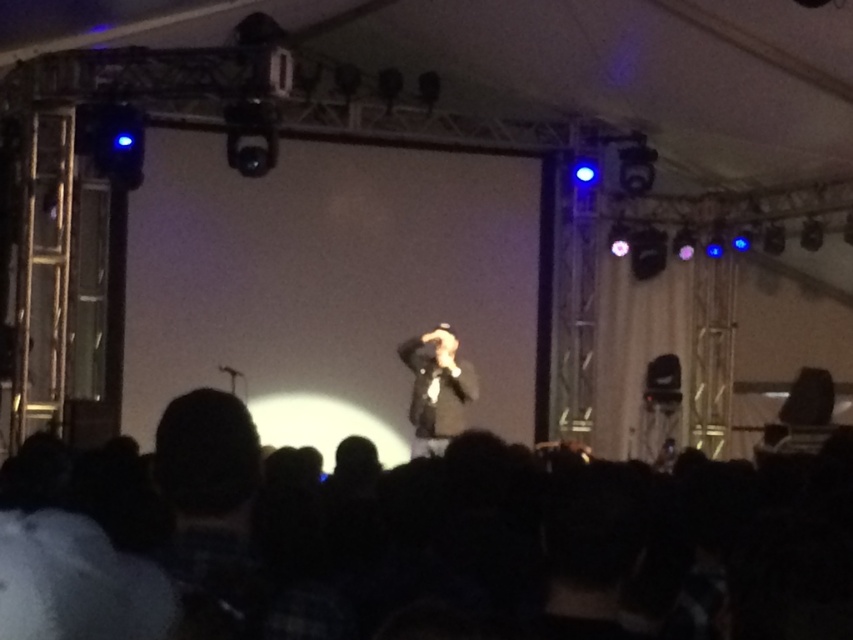
You are an audience member sitting in the front row. You notice a black fabric at lower center and a dark suit at center. Which object is closer to you?

The black fabric at lower center is closer to the viewer than the dark suit at center.

You are a stagehand holding a ladder that is 1.2 meters long. You need to reach the black fabric at lower center to adjust it. Can you safely reach it using the ladder without extending it further?

The distance between the black fabric at lower center and the camera is 1.18 meters, which is slightly less than the ladder length of 1.2 meters. Therefore, the ladder can safely reach the black fabric at lower center when positioned properly.

You are an event organizer checking the stage setup. You notice the black fabric at lower center and the dark suit at center. Which object is located to the left of the other?

The black fabric at lower center is positioned on the left side of dark suit at center.